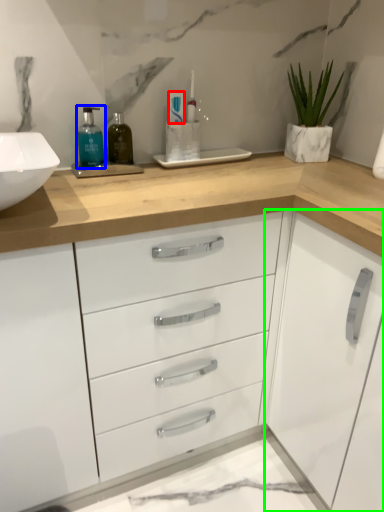
Question: Estimate the real-world distances between objects in this image. Which object is farther from toothpaste (highlighted by a red box), mouthwash (highlighted by a blue box) or cabinetry (highlighted by a green box)?

Choices:
 (A) mouthwash
 (B) cabinetry

Answer: (B)